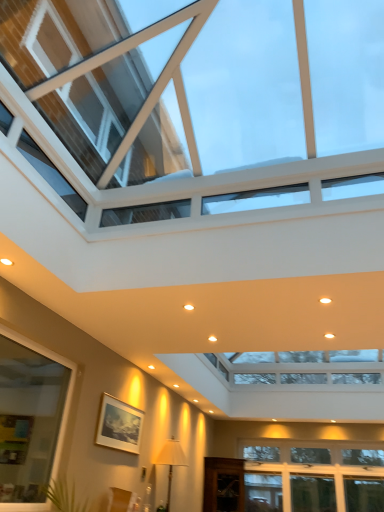
Question: Is clear glass window at lower left, the 2th window when ordered from bottom to top, in front of or behind transparent glass window at upper center, which ranks as the first window in top-to-bottom order, in the image?

Choices:
 (A) front
 (B) behind

Answer: (B)

Question: From a real-world perspective, is clear glass window at lower left, the 2th window from the top, physically located above or below transparent glass window at upper center, placed as the 3th window when sorted from bottom to top?

Choices:
 (A) below
 (B) above

Answer: (A)

Question: Based on their relative distances, which object is nearer to the white fabric lampshade at lower center?

Choices:
 (A) transparent glass window at upper center, which ranks as the first window in top-to-bottom order
 (B) transparent wooden cabinet at lower center
 (C) white glass window at lower right, the 1th window when ordered from bottom to top
 (D) clear glass window at lower left, the 2th window when ordered from bottom to top
 (E) matte silver picture frame at lower left

Answer: (E)

Question: Which object is positioned farthest from the matte silver picture frame at lower left?

Choices:
 (A) transparent wooden cabinet at lower center
 (B) transparent glass window at upper center, placed as the 3th window when sorted from bottom to top
 (C) white fabric lampshade at lower center
 (D) clear glass window at lower left, the 2th window when ordered from bottom to top
 (E) white glass window at lower right, which ranks as the third window in top-to-bottom order

Answer: (E)